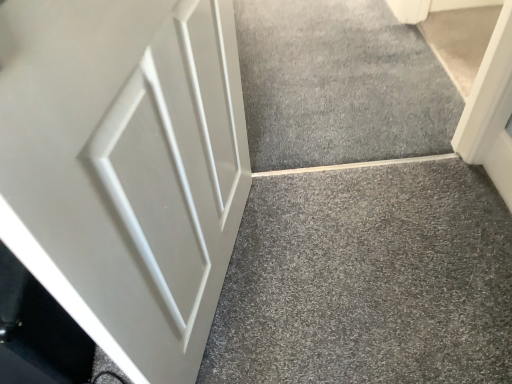
The height and width of the screenshot is (384, 512). I want to click on gray carpet at center, so click(x=339, y=85).

The height and width of the screenshot is (384, 512). What do you see at coordinates (339, 85) in the screenshot?
I see `gray carpet at center` at bounding box center [339, 85].

Where is `white matte door at left`? The width and height of the screenshot is (512, 384). white matte door at left is located at coordinates (125, 168).

Describe the element at coordinates (125, 168) in the screenshot. I see `white matte door at left` at that location.

Find the location of a particular element. This screenshot has width=512, height=384. gray carpet at center is located at coordinates (339, 85).

Which is more to the right, gray carpet at center or white matte door at left?

gray carpet at center.

Relative to white matte door at left, is gray carpet at center in front or behind?

gray carpet at center is positioned farther from the viewer than white matte door at left.

Does point (322, 31) appear closer or farther from the camera than point (57, 216)?

Point (322, 31) is positioned farther from the camera compared to point (57, 216).

In the scene shown: From the image's perspective, is gray carpet at center below white matte door at left?

No, from the image's perspective, gray carpet at center is not beneath white matte door at left.

From a real-world perspective, which is physically below, gray carpet at center or white matte door at left?

gray carpet at center is physically lower.

Considering the relative sizes of gray carpet at center and white matte door at left in the image provided, is gray carpet at center wider than white matte door at left?

Correct, the width of gray carpet at center exceeds that of white matte door at left.

Considering the relative sizes of gray carpet at center and white matte door at left in the image provided, is gray carpet at center taller than white matte door at left?

In fact, gray carpet at center may be shorter than white matte door at left.

Who is bigger, gray carpet at center or white matte door at left?

white matte door at left is bigger.

Is white matte door at left surrounded by gray carpet at center?

No, white matte door at left is located outside of gray carpet at center.

Is there a large distance between gray carpet at center and white matte door at left?

No.

Is gray carpet at center turned away from white matte door at left?

No, gray carpet at center is not facing away from white matte door at left.

What's the angular difference between gray carpet at center and white matte door at left's facing directions?

A: 24.1 degrees separate the facing orientations of gray carpet at center and white matte door at left.

How far apart are gray carpet at center and white matte door at left?

gray carpet at center is 35.21 inches away from white matte door at left.

Image resolution: width=512 pixels, height=384 pixels. I want to click on door below the gray carpet at center (from the image's perspective), so click(x=125, y=168).

Considering the relative positions of white matte door at left and gray carpet at center in the image provided, is white matte door at left to the left of gray carpet at center from the viewer's perspective?

Indeed, white matte door at left is positioned on the left side of gray carpet at center.

Which is in front, white matte door at left or gray carpet at center?

white matte door at left is more forward.

Is point (195, 254) in front of point (347, 155)?

Yes, point (195, 254) is in front of point (347, 155).

From the image's perspective, is white matte door at left located above or below gray carpet at center?

white matte door at left is below gray carpet at center.

From a real-world perspective, who is located higher, white matte door at left or gray carpet at center?

white matte door at left, from a real-world perspective.

Which of these two, white matte door at left or gray carpet at center, is thinner?

Thinner between the two is white matte door at left.

Who is taller, white matte door at left or gray carpet at center?

Standing taller between the two is white matte door at left.

From the picture: Based on their sizes in the image, would you say white matte door at left is bigger or smaller than gray carpet at center?

white matte door at left is bigger than gray carpet at center.

Would you say white matte door at left is inside or outside gray carpet at center?

white matte door at left is not inside gray carpet at center, it's outside.

Is white matte door at left touching gray carpet at center?

No, white matte door at left is not with gray carpet at center.

Is white matte door at left positioned with its back to gray carpet at center?

white matte door at left is not turned away from gray carpet at center.

What's the angular difference between white matte door at left and gray carpet at center's facing directions?

The angle between the facing direction of white matte door at left and the facing direction of gray carpet at center is 24.1 degrees.

How far apart are white matte door at left and gray carpet at center?

white matte door at left and gray carpet at center are 35.21 inches apart.

Where is `door on the left of gray carpet at center`? door on the left of gray carpet at center is located at coordinates (125, 168).

I want to click on door positioned vertically above the gray carpet at center (from a real-world perspective), so click(125, 168).

Identify the location of concrete located underneath the white matte door at left (from a real-world perspective). (339, 85).